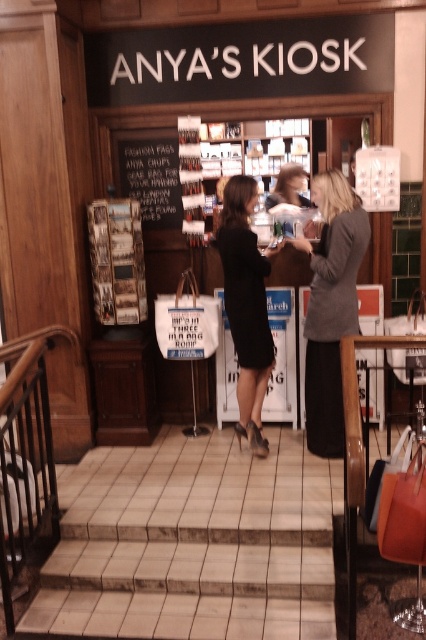
Question: Is gray wool sweater at center thinner than black satin dress at center?

Choices:
 (A) yes
 (B) no

Answer: (A)

Question: Among these points, which one is farthest from the camera?

Choices:
 (A) (345, 326)
 (B) (232, 285)

Answer: (B)

Question: Can you confirm if black satin dress at center is positioned above black chalkboard at center?

Choices:
 (A) no
 (B) yes

Answer: (A)

Question: Is black satin dress at center thinner than black chalkboard at center?

Choices:
 (A) no
 (B) yes

Answer: (A)

Question: Estimate the real-world distances between objects in this image. Which object is farther from the black satin dress at center?

Choices:
 (A) black chalkboard at center
 (B) gray wool sweater at center

Answer: (A)

Question: Among these points, which one is nearest to the camera?

Choices:
 (A) (362, 216)
 (B) (123, 168)

Answer: (A)